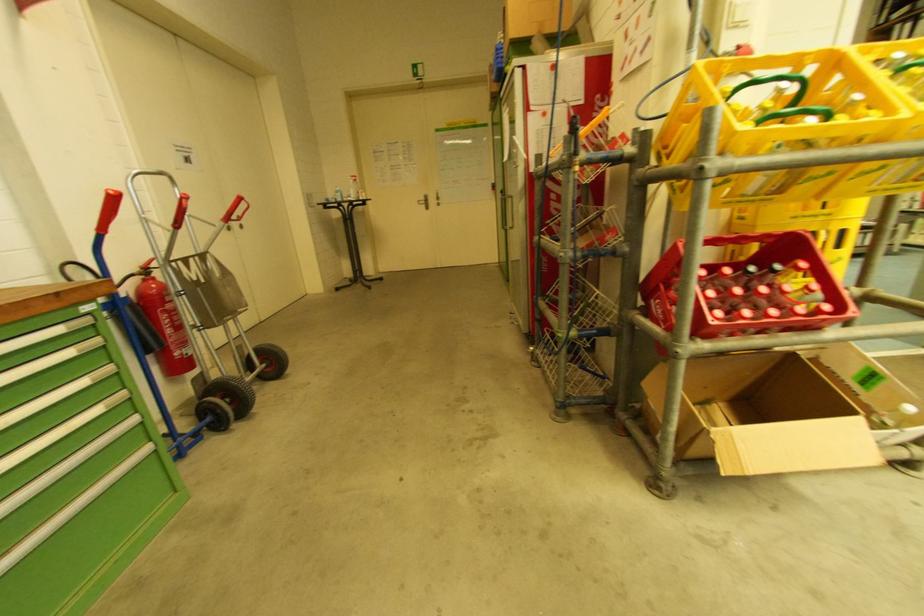
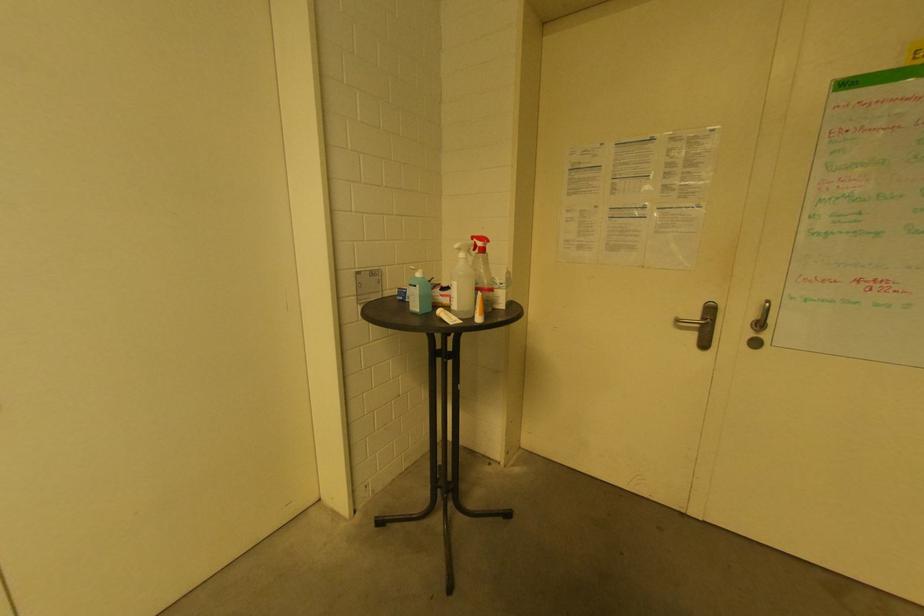
Locate, in the second image, the point that corresponds to point (354, 183) in the first image.

(464, 256)